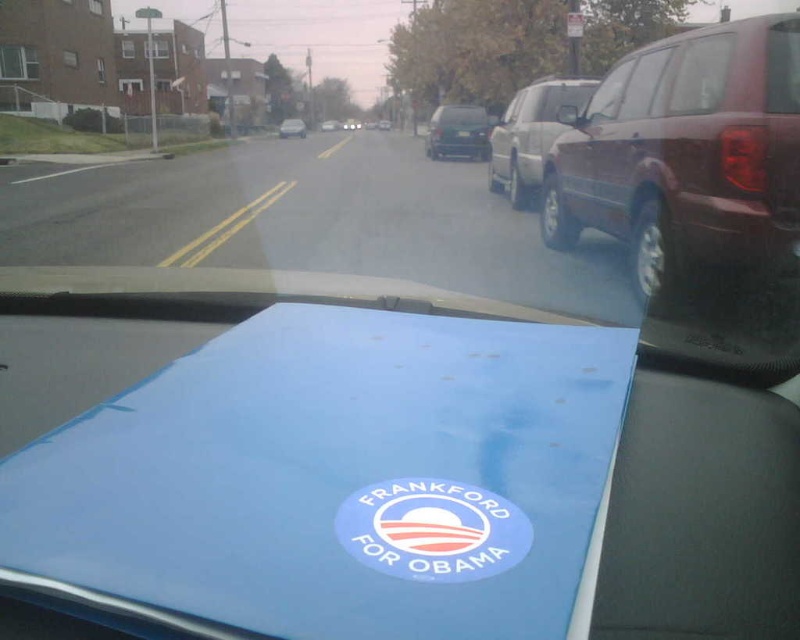
You are a passenger in the car and notice two objects in front of you. One is the blue matte sticker at center and the other is the metallic silver sedan at center. Which object is closer to you?

The blue matte sticker at center is positioned under the metallic silver sedan at center, meaning the metallic silver sedan at center is closer to you than the blue matte sticker at center.

Looking at this image, you are sitting in the driver seat of the car and looking out through the windshield. There are two points marked on the windshield. One is at coordinate point (478, 148) and the other is at point (300, 125). Which point is closer to your eyes?

Point (478, 148) is closer to the viewer than point (300, 125).

You are sitting in the driver seat of the car and looking out the windshield. There is a point at coordinate (x=532, y=132) on the windshield. What object does this point correspond to?

The point at coordinate (x=532, y=132) corresponds to the satin silver suv at right.